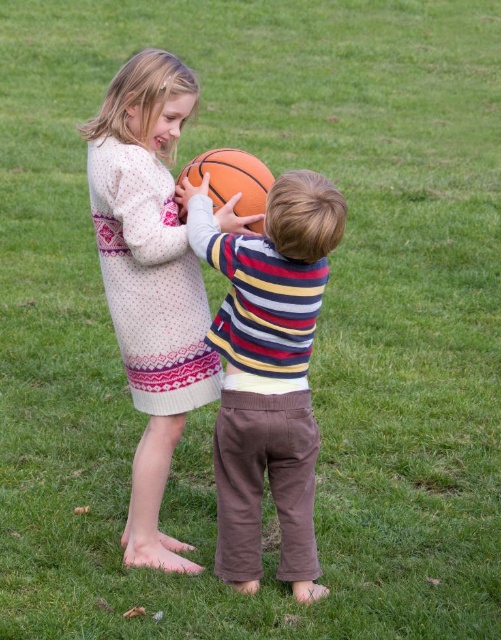
Question: Is knitted sweater at center behind orange textured basketball at center?

Choices:
 (A) no
 (B) yes

Answer: (A)

Question: Based on their relative distances, which object is farther from the matte striped sweater at center?

Choices:
 (A) knitted sweater at center
 (B) orange textured basketball at center

Answer: (B)

Question: Which point is closer to the camera?

Choices:
 (A) knitted sweater at center
 (B) orange textured basketball at center

Answer: (A)

Question: In this image, where is matte striped sweater at center located relative to knitted sweater at center?

Choices:
 (A) left
 (B) right

Answer: (B)

Question: Does matte striped sweater at center have a larger size compared to orange textured basketball at center?

Choices:
 (A) yes
 (B) no

Answer: (A)

Question: Which object appears closest to the camera in this image?

Choices:
 (A) knitted sweater at center
 (B) orange textured basketball at center

Answer: (A)